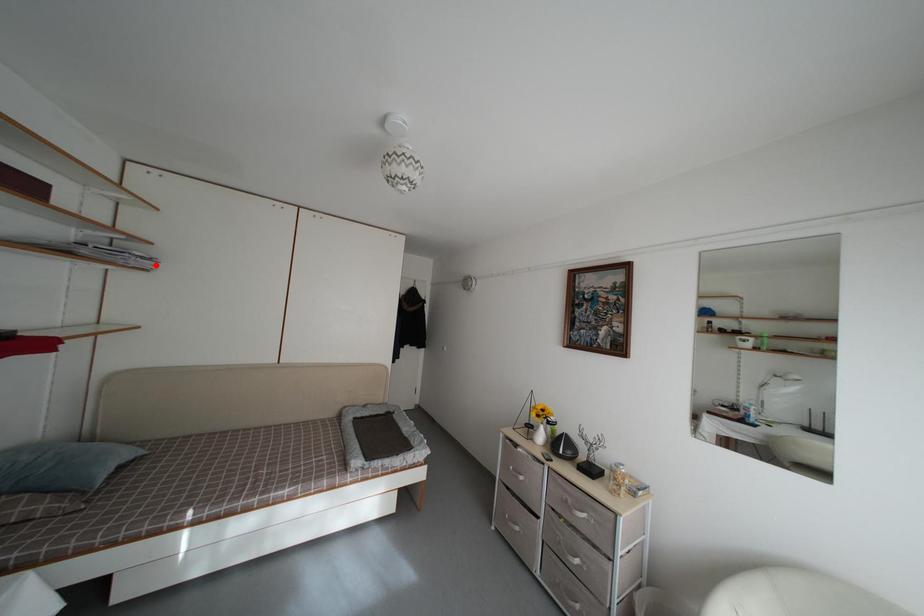
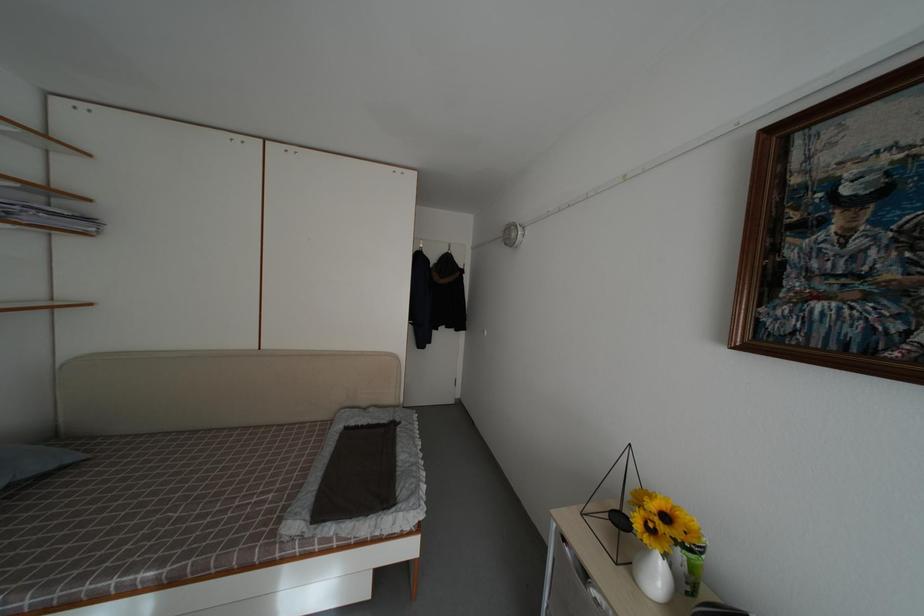
Where in the second image is the point corresponding to the highlighted location from the first image?

(94, 225)